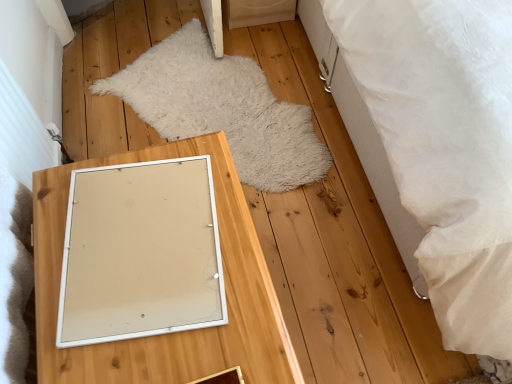
Locate an element on the screen. This screenshot has width=512, height=384. free area below white matte picture frame at center (from a real-world perspective) is located at coordinates (135, 236).